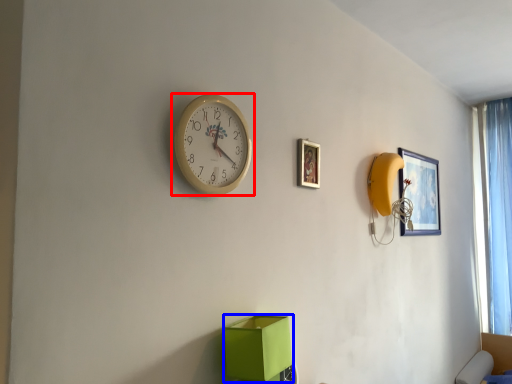
Question: Among these objects, which one is farthest to the camera, wall clock (highlighted by a red box) or cardboard box (highlighted by a blue box)?

Choices:
 (A) wall clock
 (B) cardboard box

Answer: (B)